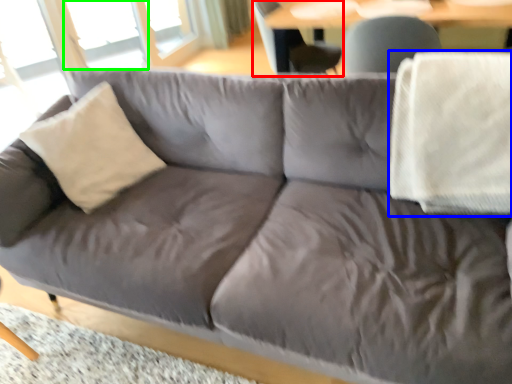
Question: Estimate the real-world distances between objects in this image. Which object is farther from swivel chair (highlighted by a red box), blanket (highlighted by a blue box) or window (highlighted by a green box)?

Choices:
 (A) blanket
 (B) window

Answer: (B)